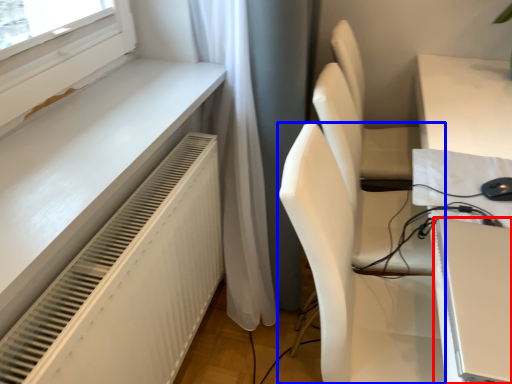
Question: Which object appears closest to the camera in this image, computer (highlighted by a red box) or chair (highlighted by a blue box)?

Choices:
 (A) computer
 (B) chair

Answer: (A)